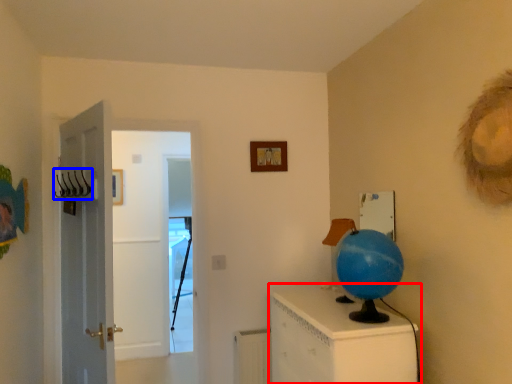
Question: Which object appears closest to the camera in this image, furniture (highlighted by a red box) or hanger (highlighted by a blue box)?

Choices:
 (A) furniture
 (B) hanger

Answer: (A)